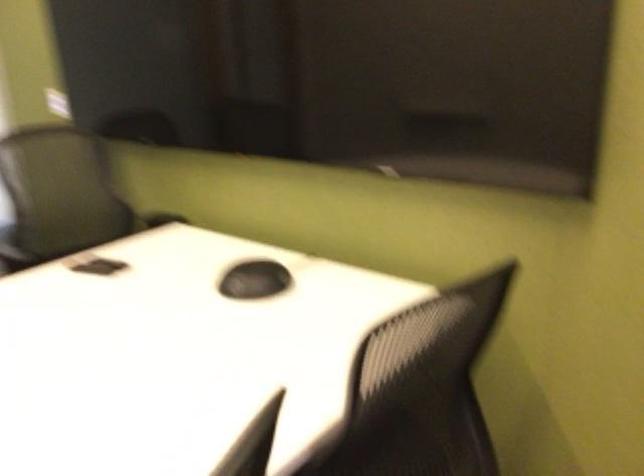
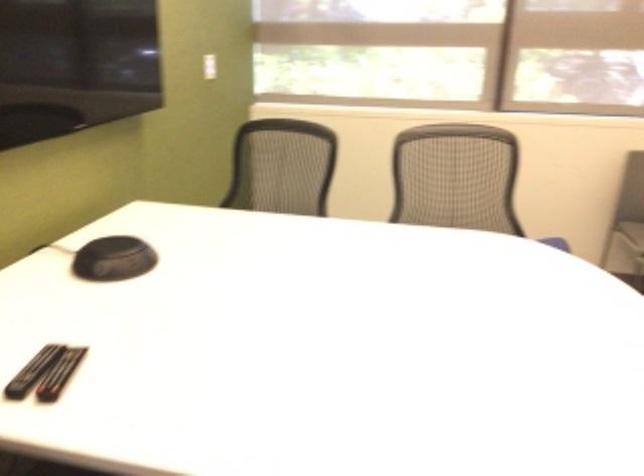
Locate, in the second image, the point that corresponds to point (109, 260) in the first image.

(32, 371)